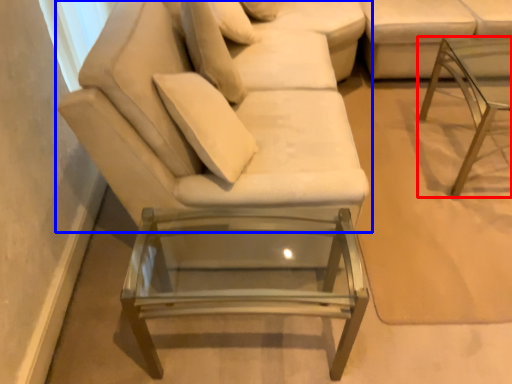
Question: Which of the following is the closest to the observer, table (highlighted by a red box) or studio couch (highlighted by a blue box)?

Choices:
 (A) table
 (B) studio couch

Answer: (B)